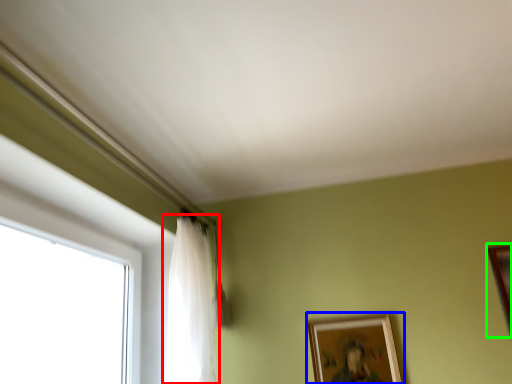
Question: Which object is positioned closest to curtain (highlighted by a red box)? Select from picture frame (highlighted by a blue box) and picture frame (highlighted by a green box).

Choices:
 (A) picture frame
 (B) picture frame

Answer: (A)